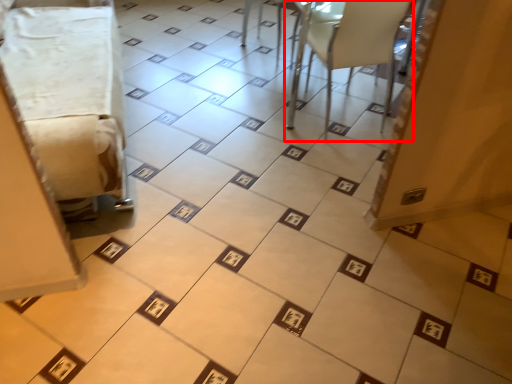
Question: From the image's perspective, what is the correct spatial relationship of furniture (annotated by the red box) in relation to furniture?

Choices:
 (A) above
 (B) below

Answer: (A)